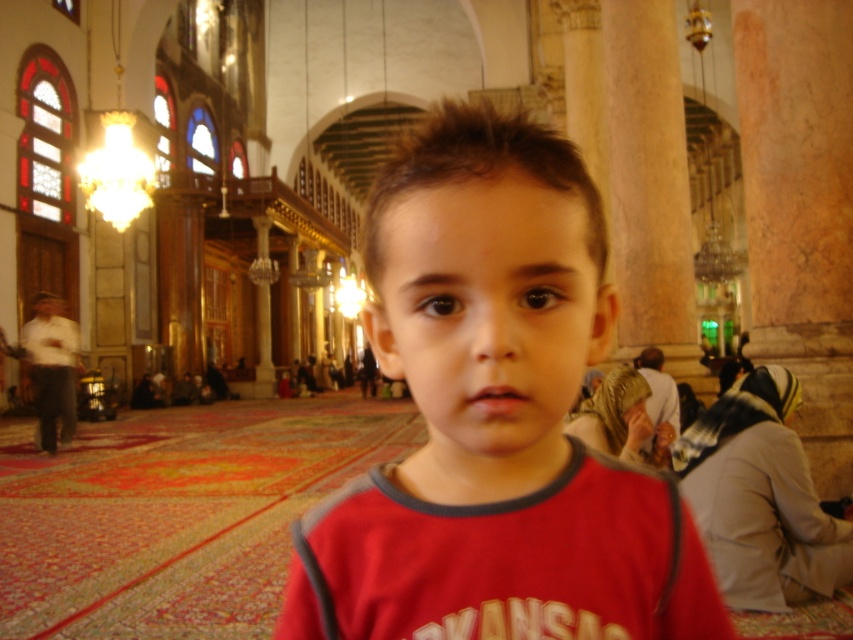
You are a photographer taking a picture of the mosque interior. You notice the red matte shirt at center and the brown matte face at center in the frame. Which object is located to the right of the other?

The red matte shirt at center is positioned on the right side of brown matte face at center, so the red matte shirt at center is to the right of the brown matte face at center.

You are standing in the grand mosque and see the point marked as point (x=494, y=419). What object is located at this point?

The point (x=494, y=419) corresponds to the red matte shirt at center.

You are a photographer trying to capture the child in the mosque. You want to ensure the red matte shirt at center and the brown matte face at center are both visible in the frame. Given their sizes, which object should you focus on to ensure both are in focus?

The red matte shirt at center is narrower than the brown matte face at center, so focusing on the brown matte face at center will help keep both in focus since it is wider.